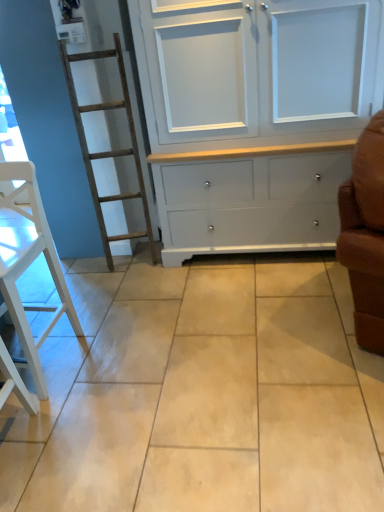
Find the location of `vacant point above beige ceramic tile at center (from a real-world perspective)`. vacant point above beige ceramic tile at center (from a real-world perspective) is located at coordinates (233, 329).